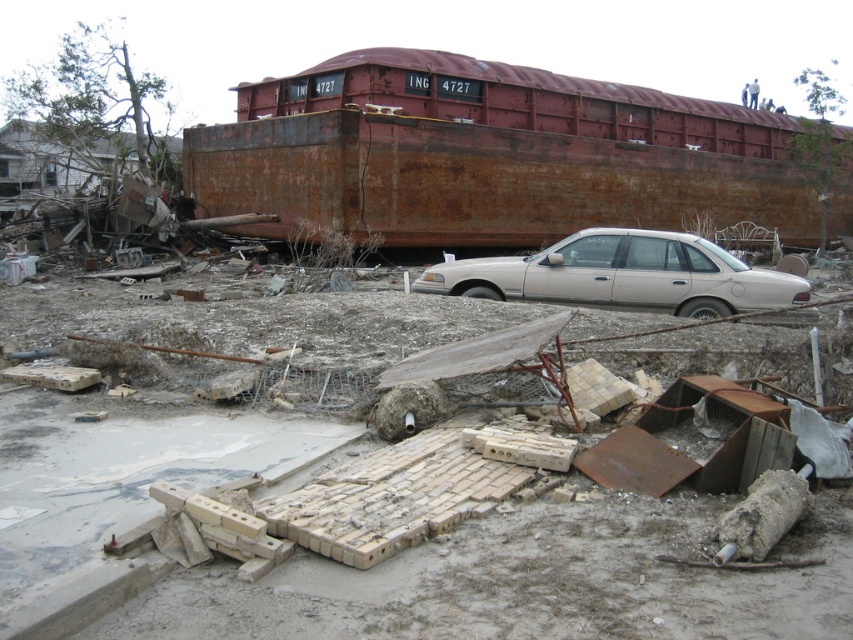
Does point (598, 189) lie in front of point (485, 273)?

No, (598, 189) is behind (485, 273).

This screenshot has width=853, height=640. I want to click on rusty metal train car at upper center, so click(500, 156).

Is point (440, 484) farther from camera compared to point (474, 180)?

No, it is not.

How far apart are rusty metal debris at center and rusty metal train car at upper center?

rusty metal debris at center and rusty metal train car at upper center are 69.11 feet apart.

The image size is (853, 640). I want to click on rusty metal debris at center, so click(328, 538).

Between rusty metal debris at center and white matte sedan at center, which one appears on the right side from the viewer's perspective?

white matte sedan at center is more to the right.

This screenshot has height=640, width=853. What do you see at coordinates (328, 538) in the screenshot?
I see `rusty metal debris at center` at bounding box center [328, 538].

This screenshot has height=640, width=853. Find the location of `rusty metal debris at center`. rusty metal debris at center is located at coordinates 328,538.